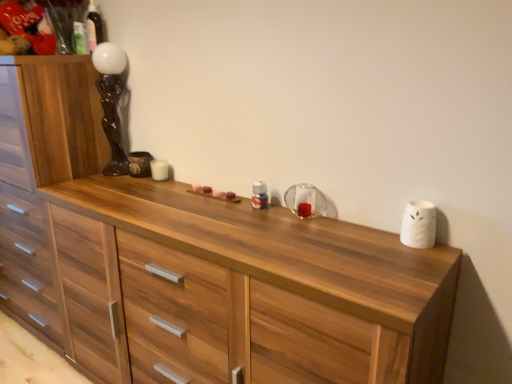
This screenshot has width=512, height=384. I want to click on wooden chest of drawers at left, so click(x=57, y=215).

Describe the element at coordinates (57, 215) in the screenshot. I see `wooden chest of drawers at left` at that location.

Measure the distance between black glossy statue at upper left and camera.

black glossy statue at upper left and camera are 1.75 meters apart from each other.

The width and height of the screenshot is (512, 384). Describe the element at coordinates (111, 102) in the screenshot. I see `black glossy statue at upper left` at that location.

I want to click on black glossy statue at upper left, so click(111, 102).

Locate an element on the screen. The height and width of the screenshot is (384, 512). wooden chest of drawers at left is located at coordinates (57, 215).

Considering the relative positions of black glossy statue at upper left and wooden chest of drawers at left in the image provided, is black glossy statue at upper left to the left or to the right of wooden chest of drawers at left?

In the image, black glossy statue at upper left appears on the right side of wooden chest of drawers at left.

Who is more distant, black glossy statue at upper left or wooden chest of drawers at left?

black glossy statue at upper left is further from the camera.

Is point (115, 163) positioned behind point (65, 324)?

Yes, point (115, 163) is farther from viewer.

From the image's perspective, which one is positioned lower, black glossy statue at upper left or wooden chest of drawers at left?

From the image's view, wooden chest of drawers at left is below.

From a real-world perspective, is black glossy statue at upper left physically located above or below wooden chest of drawers at left?

black glossy statue at upper left is above wooden chest of drawers at left.

In terms of width, does black glossy statue at upper left look wider or thinner when compared to wooden chest of drawers at left?

black glossy statue at upper left is thinner than wooden chest of drawers at left.

Considering the sizes of objects black glossy statue at upper left and wooden chest of drawers at left in the image provided, who is taller, black glossy statue at upper left or wooden chest of drawers at left?

wooden chest of drawers at left.

Consider the image. Which of these two, black glossy statue at upper left or wooden chest of drawers at left, is smaller?

Smaller between the two is black glossy statue at upper left.

Can we say black glossy statue at upper left lies outside wooden chest of drawers at left?

Absolutely, black glossy statue at upper left is external to wooden chest of drawers at left.

Would you say black glossy statue at upper left is a long distance from wooden chest of drawers at left?

Actually, black glossy statue at upper left and wooden chest of drawers at left are a little close together.

Is black glossy statue at upper left oriented away from wooden chest of drawers at left?

No, wooden chest of drawers at left is not at the back of black glossy statue at upper left.

Can you tell me how much black glossy statue at upper left and wooden chest of drawers at left differ in facing direction?

They differ by 1.35 degrees in their facing directions.

Identify the location of lamp above the wooden chest of drawers at left (from the image's perspective). (111, 102).

Considering the relative positions of wooden chest of drawers at left and black glossy statue at upper left in the image provided, is wooden chest of drawers at left to the left of black glossy statue at upper left from the viewer's perspective?

Yes, wooden chest of drawers at left is to the left of black glossy statue at upper left.

Is wooden chest of drawers at left positioned behind black glossy statue at upper left?

No, it is in front of black glossy statue at upper left.

Does point (42, 141) come farther from viewer compared to point (120, 147)?

No, (42, 141) is in front of (120, 147).

From the image's perspective, which one is positioned higher, wooden chest of drawers at left or black glossy statue at upper left?

From the image's view, black glossy statue at upper left is above.

From a real-world perspective, between wooden chest of drawers at left and black glossy statue at upper left, who is vertically lower?

wooden chest of drawers at left.

Considering the relative sizes of wooden chest of drawers at left and black glossy statue at upper left in the image provided, is wooden chest of drawers at left wider than black glossy statue at upper left?

Correct, the width of wooden chest of drawers at left exceeds that of black glossy statue at upper left.

In terms of height, does wooden chest of drawers at left look taller or shorter compared to black glossy statue at upper left?

Considering their sizes, wooden chest of drawers at left has more height than black glossy statue at upper left.

Is wooden chest of drawers at left smaller than black glossy statue at upper left?

No.

Based on the photo, is black glossy statue at upper left a part of wooden chest of drawers at left?

That's incorrect, black glossy statue at upper left is not inside wooden chest of drawers at left.

Is wooden chest of drawers at left in contact with black glossy statue at upper left?

wooden chest of drawers at left is not next to black glossy statue at upper left, and they're not touching.

Is wooden chest of drawers at left positioned with its back to black glossy statue at upper left?

No, wooden chest of drawers at left is not facing the opposite direction of black glossy statue at upper left.

How many degrees apart are the facing directions of wooden chest of drawers at left and black glossy statue at upper left?

The angular difference between wooden chest of drawers at left and black glossy statue at upper left is 1.35 degrees.

You are a GUI agent. You are given a task and a screenshot of the screen. Output one action in this format:
    pyautogui.click(x=<x>, y=<y>)
    Task: Click on the chest of drawers on the left of black glossy statue at upper left
    The image size is (512, 384).
    Given the screenshot: What is the action you would take?
    pyautogui.click(x=57, y=215)

At what (x,y) coordinates should I click in order to perform the action: click on lamp on the right of wooden chest of drawers at left. Please return your answer as a coordinate pair (x, y). Looking at the image, I should click on (111, 102).

At what (x,y) coordinates should I click in order to perform the action: click on chest of drawers in front of the black glossy statue at upper left. Please return your answer as a coordinate pair (x, y). This screenshot has width=512, height=384. Looking at the image, I should click on 57,215.